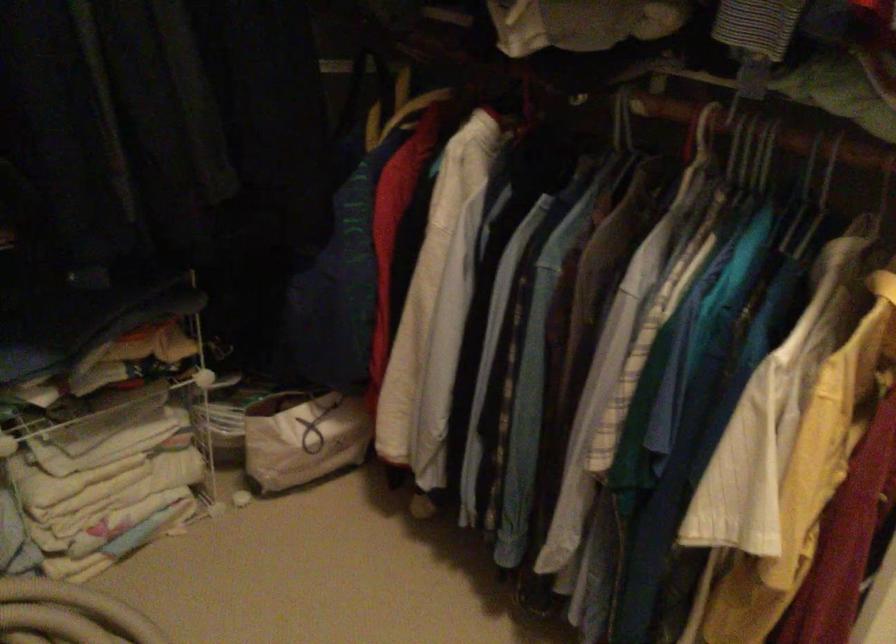
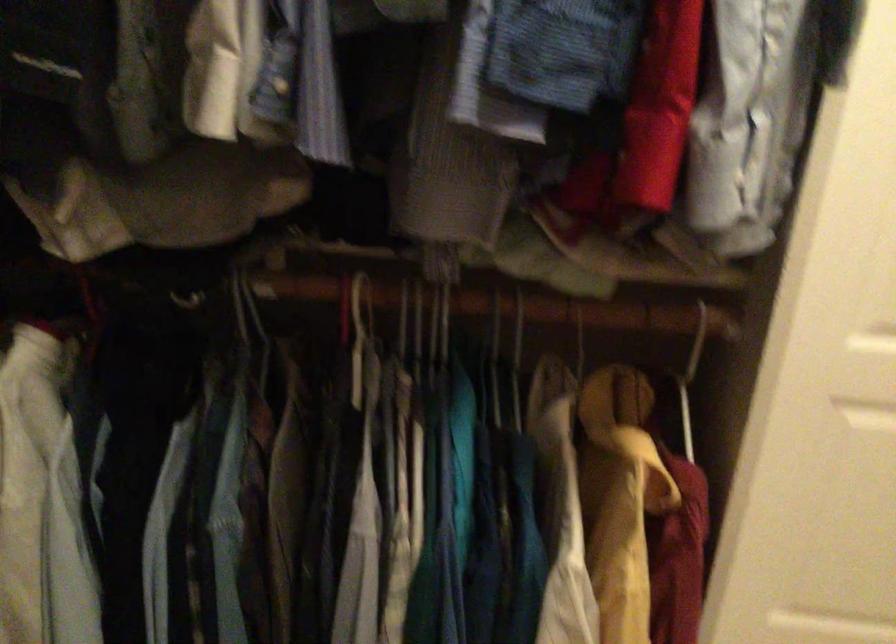
Question: The camera is either moving clockwise (left) or counter-clockwise (right) around the object. The first image is from the beginning of the video and the second image is from the end. Is the camera moving left or right when shooting the video?

Choices:
 (A) Left
 (B) Right

Answer: (A)